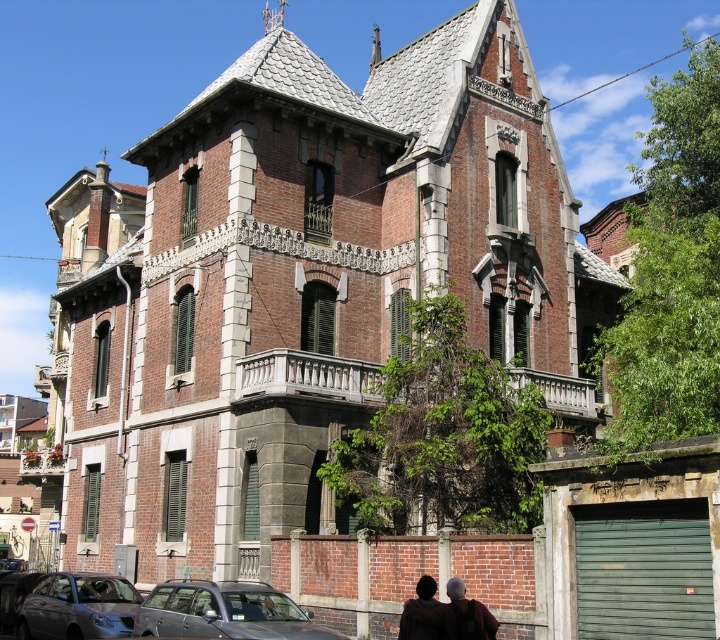
Question: Which of the following is the farthest from the observer?

Choices:
 (A) shiny black car at lower left
 (B) matte gray car at lower left
 (C) metallic gray sedan at lower left

Answer: (A)

Question: Does matte brown hair at lower center have a lesser width compared to shiny black car at lower left?

Choices:
 (A) no
 (B) yes

Answer: (B)

Question: Does matte gray car at lower left have a smaller size compared to shiny black car at lower left?

Choices:
 (A) yes
 (B) no

Answer: (B)

Question: Where is matte gray car at lower left located in relation to shiny black car at lower left in the image?

Choices:
 (A) below
 (B) above

Answer: (B)

Question: Which point is farther to the camera?

Choices:
 (A) matte gray car at lower left
 (B) metallic gray sedan at lower left

Answer: (B)

Question: Considering the real-world distances, which object is farthest from the shiny black car at lower left?

Choices:
 (A) matte brown hair at lower center
 (B) metallic gray sedan at lower left

Answer: (A)